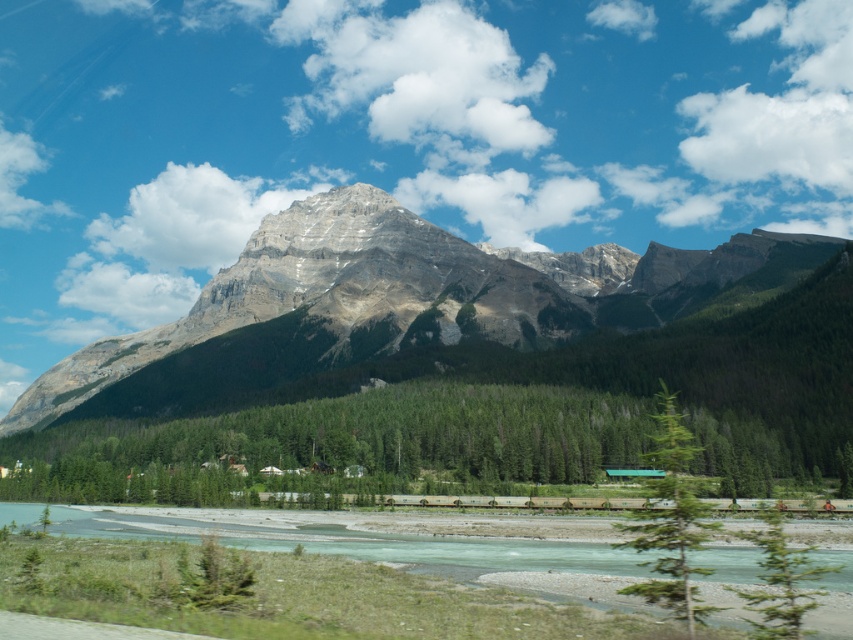
Which is below, rocky gray mountain at center or green leafy tree at center?

green leafy tree at center is below.

Can you confirm if rocky gray mountain at center is bigger than green leafy tree at center?

Yes, rocky gray mountain at center is bigger than green leafy tree at center.

The image size is (853, 640). Find the location of `rocky gray mountain at center`. rocky gray mountain at center is located at coordinates (392, 307).

Who is more forward, (250, 248) or (815, 572)?

Point (815, 572) is more forward.

Is rocky gray mountain at center above green matte tree at lower right?

Correct, rocky gray mountain at center is located above green matte tree at lower right.

Is point (772, 292) less distant than point (788, 604)?

No.

Identify the location of rocky gray mountain at center. The height and width of the screenshot is (640, 853). (392, 307).

Is point (737, 493) behind point (659, 493)?

Yes, it is behind point (659, 493).

Does point (421, 422) come in front of point (679, 566)?

No, it is not.

The image size is (853, 640). Describe the element at coordinates (344, 444) in the screenshot. I see `green matte forest at center` at that location.

Image resolution: width=853 pixels, height=640 pixels. I want to click on green matte forest at center, so click(x=344, y=444).